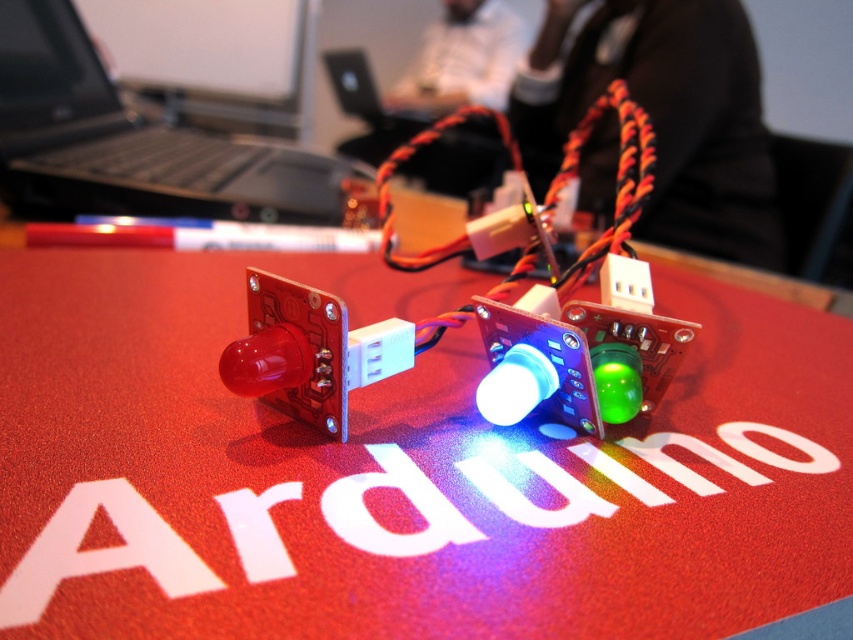
Does red matte arduino board at center have a smaller size compared to black plastic laptop at upper left?

Actually, red matte arduino board at center might be larger than black plastic laptop at upper left.

Is point (779, 326) behind point (13, 35)?

No, (779, 326) is in front of (13, 35).

Is point (645, 486) closer to camera compared to point (45, 140)?

Yes, it is.

Locate an element on the screen. The height and width of the screenshot is (640, 853). red matte arduino board at center is located at coordinates (405, 468).